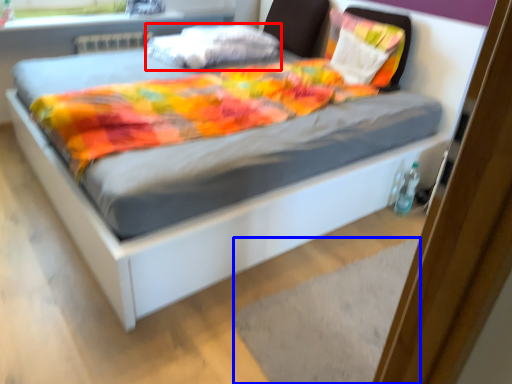
Question: Which object is further to the camera taking this photo, pillow (highlighted by a red box) or mat (highlighted by a blue box)?

Choices:
 (A) pillow
 (B) mat

Answer: (A)